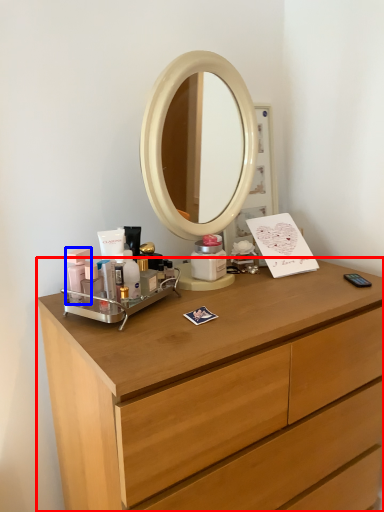
Question: Which object is closer to the camera taking this photo, chest of drawers (highlighted by a red box) or toiletry (highlighted by a blue box)?

Choices:
 (A) chest of drawers
 (B) toiletry

Answer: (A)